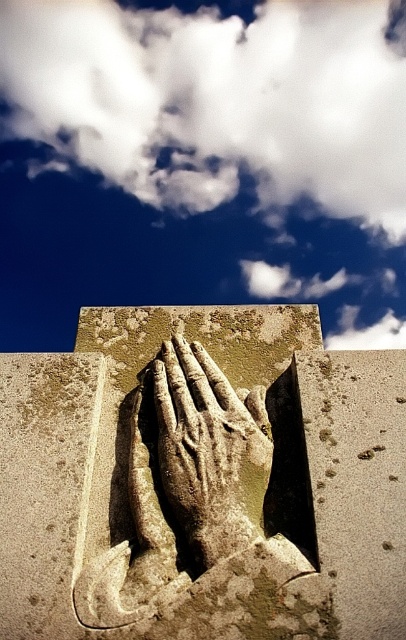
Question: Does white fluffy cloud at upper center come behind rough stone hand at center?

Choices:
 (A) no
 (B) yes

Answer: (B)

Question: Where is rough stone hands at center located in relation to rough stone hand at center in the image?

Choices:
 (A) right
 (B) left

Answer: (A)

Question: Estimate the real-world distances between objects in this image. Which object is closer to the rough stone hand at center?

Choices:
 (A) rough stone hands at center
 (B) white fluffy cloud at upper center

Answer: (A)

Question: Which point appears closest to the camera in this image?

Choices:
 (A) (216, 472)
 (B) (151, 442)
 (C) (97, 65)

Answer: (A)

Question: Does rough stone hands at center have a smaller size compared to rough stone hand at center?

Choices:
 (A) no
 (B) yes

Answer: (A)

Question: Which is nearer to the rough stone hand at center?

Choices:
 (A) rough stone hands at center
 (B) white fluffy cloud at upper center

Answer: (A)